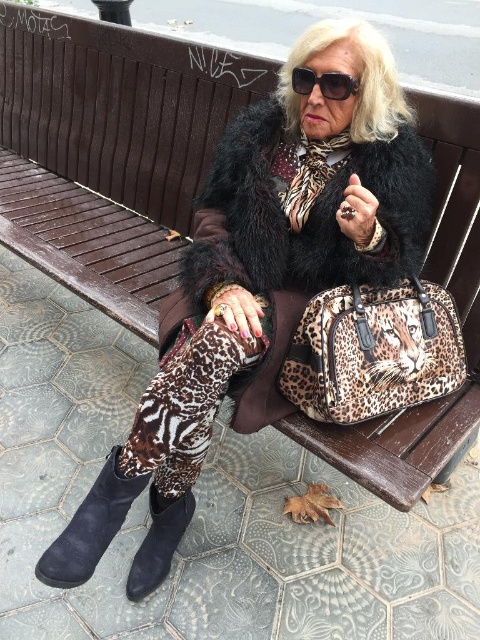
Which is behind, point (199, 244) or point (59, 541)?

The point (199, 244) is behind.

Locate an element on the screen. black furry coat at center is located at coordinates (309, 214).

Does black suede boot at lower left appear on the right side of black plastic sunglasses at upper center?

In fact, black suede boot at lower left is to the left of black plastic sunglasses at upper center.

Does black suede boot at lower left appear under black plastic sunglasses at upper center?

Yes.

Is point (141, 568) positioned after point (330, 90)?

Yes.

Find the location of a particular element. The width and height of the screenshot is (480, 640). black suede boot at lower left is located at coordinates (158, 541).

Can you confirm if suede boot at lower left is taller than black plastic sunglasses at upper center?

Correct, suede boot at lower left is much taller as black plastic sunglasses at upper center.

Is point (106, 529) closer to viewer compared to point (323, 90)?

Yes, it is.

Image resolution: width=480 pixels, height=640 pixels. Describe the element at coordinates (91, 525) in the screenshot. I see `suede boot at lower left` at that location.

Identify the location of suede boot at lower left. The image size is (480, 640). (91, 525).